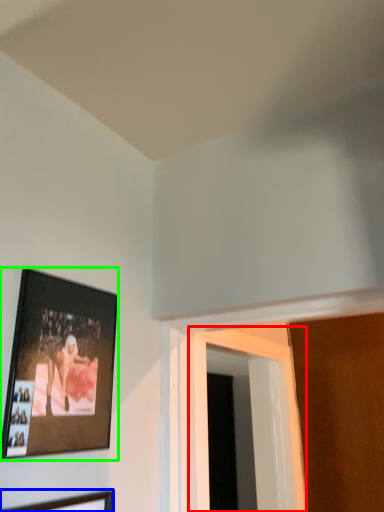
Question: Considering the real-world distances, which object is closest to window (highlighted by a red box)? picture frame (highlighted by a blue box) or picture frame (highlighted by a green box).

Choices:
 (A) picture frame
 (B) picture frame

Answer: (B)